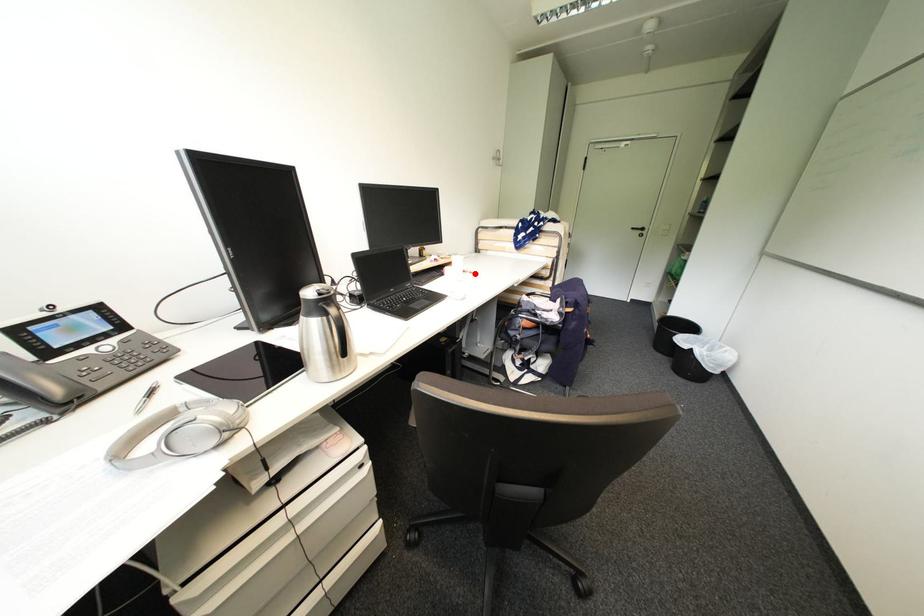
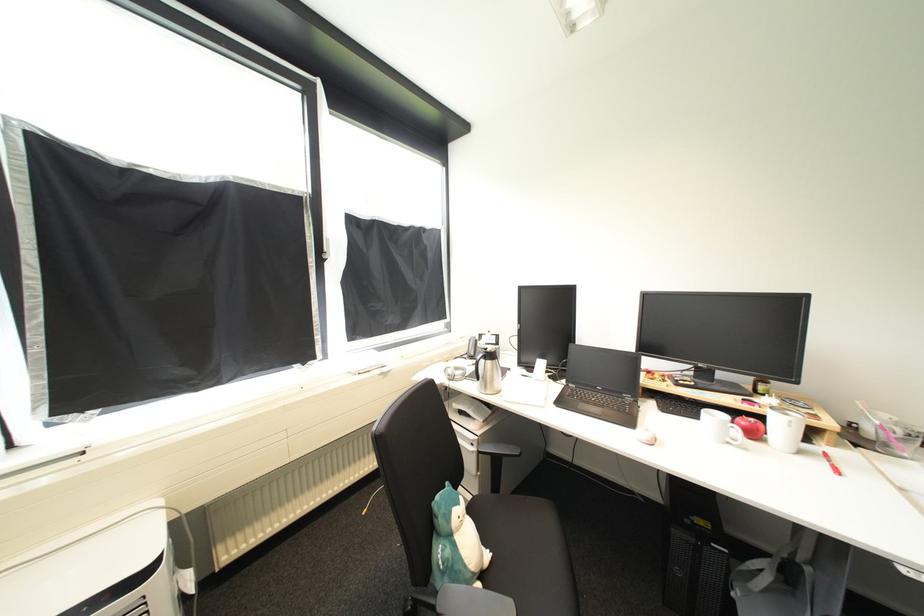
Locate, in the second image, the point that corresponds to the highlighted location in the first image.

(834, 464)